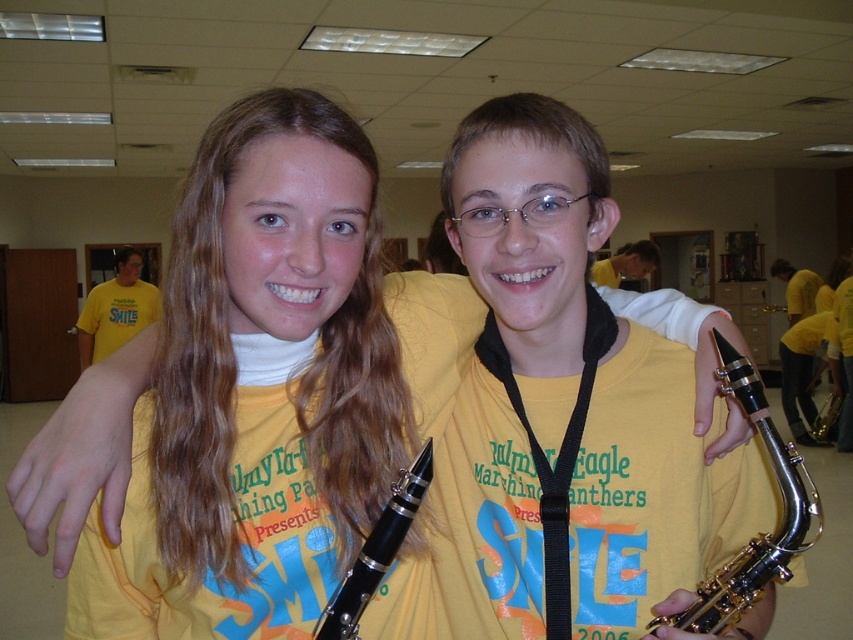
Question: Which of the following is the farthest from the observer?

Choices:
 (A) (635, 372)
 (B) (349, 586)
 (C) (712, 588)
 (D) (822, 440)

Answer: (D)

Question: Can you confirm if silver metallic saxophone at right is thinner than gold metallic saxophone at center?

Choices:
 (A) yes
 (B) no

Answer: (B)

Question: Does silver metallic saxophone at right appear under gold metallic saxophone at center?

Choices:
 (A) no
 (B) yes

Answer: (A)

Question: Estimate the real-world distances between objects in this image. Which object is farther from the silver metallic saxophone at right?

Choices:
 (A) black lacquered hautboy at center
 (B) black plastic clarinet at center
 (C) gold metallic saxophone at center

Answer: (C)

Question: Which point is closer to the camera?

Choices:
 (A) (802, 536)
 (B) (335, 612)
 (C) (636, 614)
 (D) (840, 397)

Answer: (B)

Question: Can you confirm if black lacquered hautboy at center is wider than silver metallic saxophone at right?

Choices:
 (A) no
 (B) yes

Answer: (B)